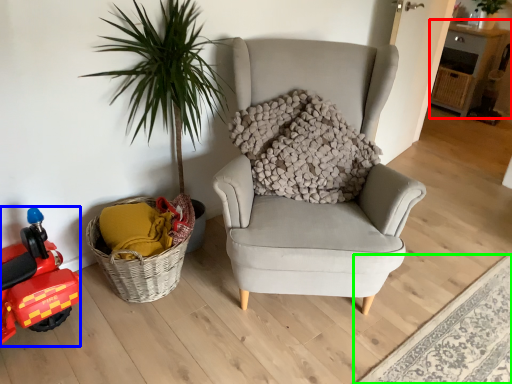
Question: Which object is the farthest from table (highlighted by a red box)? Choose among these: toy car (highlighted by a blue box) or plain (highlighted by a green box).

Choices:
 (A) toy car
 (B) plain

Answer: (A)